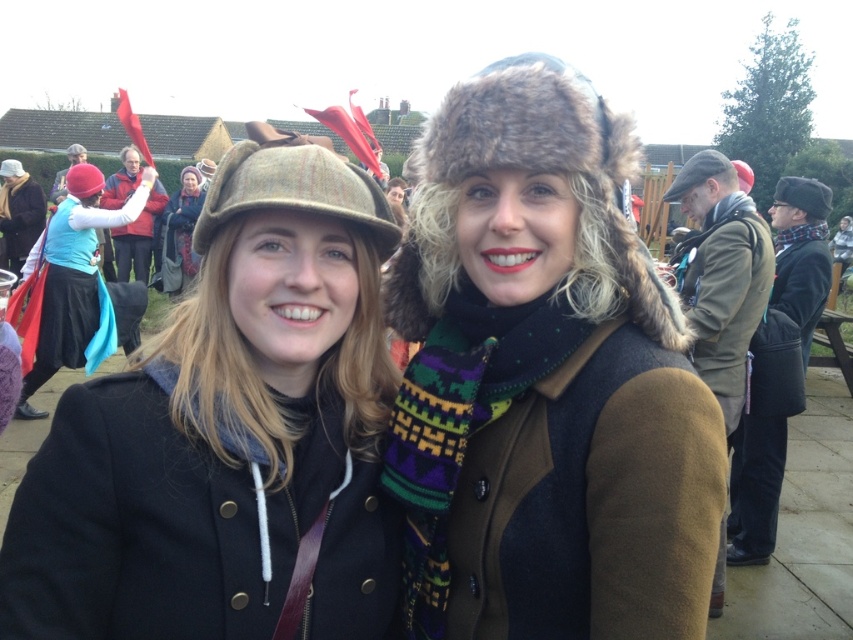
Does flat cap at upper right have a greater width compared to matte brown hat at upper left?

Yes, flat cap at upper right is wider than matte brown hat at upper left.

Is flat cap at upper right to the right of matte brown hat at upper left from the viewer's perspective?

Indeed, flat cap at upper right is positioned on the right side of matte brown hat at upper left.

Image resolution: width=853 pixels, height=640 pixels. I want to click on flat cap at upper right, so click(x=695, y=172).

Is knitted woolen hat at upper left thinner than fur-like textured hat at upper center?

No.

Does knitted woolen hat at upper left lie behind fur-like textured hat at upper center?

That is True.

Between point (194, 214) and point (809, 186), which one is positioned in front?

Point (809, 186)

Identify the location of knitted woolen hat at upper left. (178, 234).

Who is taller, flat cap at upper right or red fuzzy hat at upper right?

With more height is flat cap at upper right.

Does flat cap at upper right lie behind red fuzzy hat at upper right?

No.

Is point (663, 200) farther from camera compared to point (749, 172)?

Yes.

Find the location of `flat cap at upper right`. flat cap at upper right is located at coordinates (695, 172).